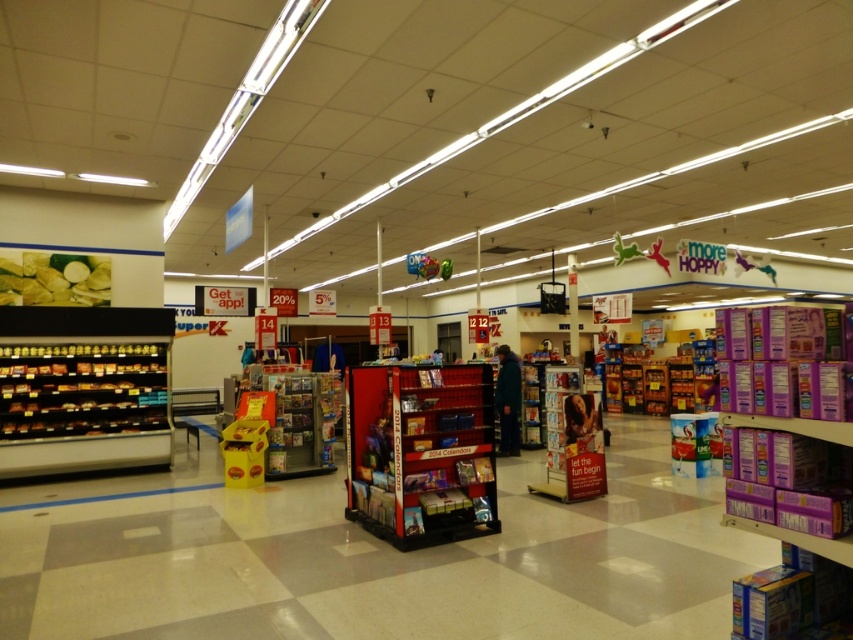
From the picture: You are a customer in the store and want to find a magazine rack. You see the metallic silver shelves at left and the matte plastic magazine rack at center. Which one is located to the left of the other?

The metallic silver shelves at left is positioned on the left side of matte plastic magazine rack at center.